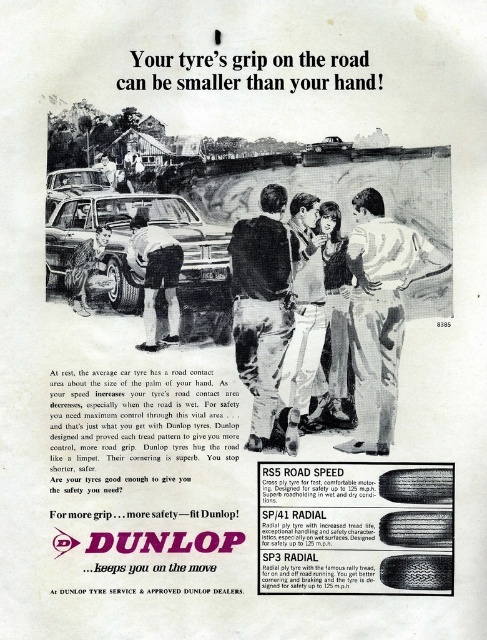
Question: Is light gray uniform at center bigger than black rubber tire at center?

Choices:
 (A) yes
 (B) no

Answer: (A)

Question: Which point is farther to the camera?

Choices:
 (A) (198, 259)
 (B) (150, 259)
 (C) (345, 369)
 (D) (239, 365)

Answer: (A)

Question: Does white striped shirt at center appear on the left side of white cotton shirt at center?

Choices:
 (A) no
 (B) yes

Answer: (A)

Question: Can you confirm if white cotton shirt at center is positioned to the left of matte black car at left?

Choices:
 (A) yes
 (B) no

Answer: (B)

Question: Estimate the real-world distances between objects in this image. Which object is closer to the white striped shirt at center?

Choices:
 (A) denim jeans at center
 (B) matte black car at left
 (C) light gray fabric shirt at lower left
 (D) black rubber tire at center

Answer: (A)

Question: Which of the following is the closest to the observer?

Choices:
 (A) (170, 252)
 (B) (276, 403)
 (C) (119, 221)

Answer: (C)